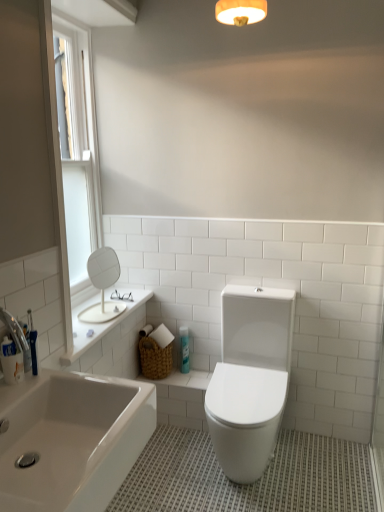
The height and width of the screenshot is (512, 384). Identify the location of vacant space in front of blue glossy spray can at center. (192, 379).